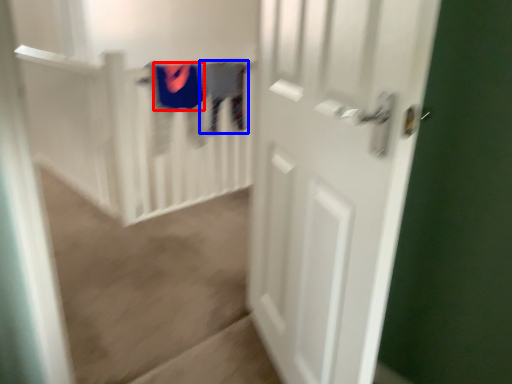
Question: Which object is closer to the camera taking this photo, clothing (highlighted by a red box) or clothing (highlighted by a blue box)?

Choices:
 (A) clothing
 (B) clothing

Answer: (A)